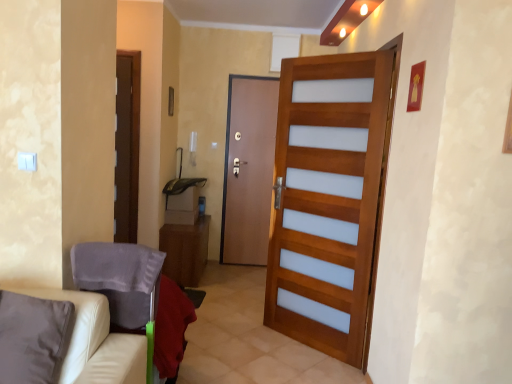
What do you see at coordinates (95, 342) in the screenshot? This screenshot has width=512, height=384. I see `beige leather couch at lower left` at bounding box center [95, 342].

This screenshot has width=512, height=384. What do you see at coordinates (248, 169) in the screenshot?
I see `brown wooden door at center, which is the second door in right-to-left order` at bounding box center [248, 169].

The height and width of the screenshot is (384, 512). What do you see at coordinates (328, 199) in the screenshot? I see `wooden door at center, the first door from the front` at bounding box center [328, 199].

What is the approximate width of wooden door at center, the second door from the back?

13.67 centimeters.

Describe the element at coordinates (122, 283) in the screenshot. I see `white leather armchair at lower left` at that location.

The height and width of the screenshot is (384, 512). I want to click on wooden cabinet at center, so click(x=185, y=250).

Locate an element on the screen. beige leather couch at lower left is located at coordinates (95, 342).

How distant is wooden cabinet at center from brown wooden door at center, the second door viewed from the front?

The distance of wooden cabinet at center from brown wooden door at center, the second door viewed from the front, is 29.19 inches.

Which is nearer, (x=202, y=248) or (x=241, y=190)?

Point (x=202, y=248) is positioned closer to the camera compared to point (x=241, y=190).

Can you confirm if wooden cabinet at center is thinner than brown wooden door at center, which is the second door in right-to-left order?

No, wooden cabinet at center is not thinner than brown wooden door at center, which is the second door in right-to-left order.

Are wooden cabinet at center and brown wooden door at center, positioned as the 1th door in left-to-right order, far apart?

No, wooden cabinet at center is not far from brown wooden door at center, positioned as the 1th door in left-to-right order.

From the image's perspective, which is above, wooden cabinet at center or wooden door at center, which appears as the 1th door when viewed from the right?

wooden door at center, which appears as the 1th door when viewed from the right, appears higher in the image.

Who is shorter, wooden cabinet at center or wooden door at center, the first door from the front?

wooden cabinet at center is shorter.

Image resolution: width=512 pixels, height=384 pixels. In order to click on the 2nd door positioned above the wooden cabinet at center (from a real-world perspective) in this screenshot , I will do `click(328, 199)`.

Considering the relative positions of wooden cabinet at center and wooden door at center, the first door from the front, in the image provided, is wooden cabinet at center to the left of wooden door at center, the first door from the front, from the viewer's perspective?

Correct, you'll find wooden cabinet at center to the left of wooden door at center, the first door from the front.

Considering the relative sizes of wooden door at center, the second door from the back, and brown wooden door at center, positioned as the 1th door in left-to-right order, in the image provided, is wooden door at center, the second door from the back, thinner than brown wooden door at center, positioned as the 1th door in left-to-right order,?

No.

Between wooden door at center, the second door in the left-to-right sequence, and brown wooden door at center, the second door viewed from the front, which one has more height?

wooden door at center, the second door in the left-to-right sequence.

The image size is (512, 384). I want to click on door above the brown wooden door at center, positioned as the 1th door in left-to-right order (from a real-world perspective), so click(x=328, y=199).

Considering the relative positions of wooden door at center, the first door from the front, and brown wooden door at center, the 1th door viewed from the back, in the image provided, is wooden door at center, the first door from the front, to the left of brown wooden door at center, the 1th door viewed from the back, from the viewer's perspective?

In fact, wooden door at center, the first door from the front, is to the right of brown wooden door at center, the 1th door viewed from the back.

Is the surface of beige leather couch at lower left in direct contact with wooden door at center, the second door in the left-to-right sequence?

There is a gap between beige leather couch at lower left and wooden door at center, the second door in the left-to-right sequence.

From the image's perspective, is beige leather couch at lower left positioned above or below wooden door at center, the second door in the left-to-right sequence?

Based on their image positions, beige leather couch at lower left is located beneath wooden door at center, the second door in the left-to-right sequence.

Could you tell me if beige leather couch at lower left is facing wooden door at center, the second door in the left-to-right sequence?

No.

Considering the sizes of objects beige leather couch at lower left and wooden door at center, the second door from the back, in the image provided, who is wider, beige leather couch at lower left or wooden door at center, the second door from the back,?

beige leather couch at lower left is wider.

Is point (122, 300) more distant than point (100, 363)?

Yes, it is behind point (100, 363).

From a real-world perspective, is white leather armchair at lower left beneath beige leather couch at lower left?

Indeed, from a real-world perspective, white leather armchair at lower left is positioned beneath beige leather couch at lower left.

Is white leather armchair at lower left in front of or behind beige leather couch at lower left in the image?

Visually, white leather armchair at lower left is located behind beige leather couch at lower left.

Considering the relative positions of white leather armchair at lower left and beige leather couch at lower left in the image provided, is white leather armchair at lower left to the left of beige leather couch at lower left from the viewer's perspective?

No, white leather armchair at lower left is not to the left of beige leather couch at lower left.

Between brown wooden door at center, the 1th door viewed from the back, and wooden cabinet at center, which one has smaller width?

With smaller width is brown wooden door at center, the 1th door viewed from the back.

Would you consider brown wooden door at center, which is the second door in right-to-left order, to be distant from wooden cabinet at center?

brown wooden door at center, which is the second door in right-to-left order, is near wooden cabinet at center, not far away.

Based on their positions, is brown wooden door at center, the 1th door viewed from the back, located to the left or right of wooden cabinet at center?

brown wooden door at center, the 1th door viewed from the back, is positioned on wooden cabinet at center's right side.

I want to click on table below the brown wooden door at center, the 1th door viewed from the back (from the image's perspective), so click(185, 250).

Locate an element on the screen. The width and height of the screenshot is (512, 384). table above the beige leather couch at lower left (from the image's perspective) is located at coordinates (185, 250).

Is beige leather couch at lower left inside the boundaries of wooden cabinet at center, or outside?

beige leather couch at lower left is located beyond the bounds of wooden cabinet at center.

Is beige leather couch at lower left bigger or smaller than wooden cabinet at center?

Considering their sizes, beige leather couch at lower left takes up less space than wooden cabinet at center.

The height and width of the screenshot is (384, 512). Identify the location of door that appears behind the wooden cabinet at center. (248, 169).

At what (x,y) coordinates should I click in order to perform the action: click on the 2nd door directly above the wooden cabinet at center (from a real-world perspective). Please return your answer as a coordinate pair (x, y). This screenshot has height=384, width=512. Looking at the image, I should click on (328, 199).

Considering their positions, is brown wooden door at center, positioned as the 1th door in left-to-right order, positioned closer to white leather armchair at lower left than wooden door at center, the second door in the left-to-right sequence?

wooden door at center, the second door in the left-to-right sequence, is closer to white leather armchair at lower left.

From the image, which object appears to be nearer to brown wooden door at center, which is the second door in right-to-left order, wooden cabinet at center or white leather armchair at lower left?

wooden cabinet at center.

From the picture: Based on their spatial positions, is beige leather couch at lower left or wooden cabinet at center further from wooden door at center, which appears as the 1th door when viewed from the right?

Based on the image, beige leather couch at lower left appears to be further to wooden door at center, which appears as the 1th door when viewed from the right.

Based on their spatial positions, is beige leather couch at lower left or brown wooden door at center, which is the second door in right-to-left order, closer to wooden cabinet at center?

brown wooden door at center, which is the second door in right-to-left order, is positioned closer to the anchor wooden cabinet at center.

Considering their positions, is brown wooden door at center, positioned as the 1th door in left-to-right order, positioned further to wooden cabinet at center than white leather armchair at lower left?

white leather armchair at lower left.

When comparing their distances from beige leather couch at lower left, does white leather armchair at lower left or wooden cabinet at center seem further?

wooden cabinet at center is positioned further to the anchor beige leather couch at lower left.

Looking at the image, which one is located further to beige leather couch at lower left, wooden cabinet at center or white leather armchair at lower left?

wooden cabinet at center is positioned further to the anchor beige leather couch at lower left.

In the scene shown: Considering their positions, is wooden cabinet at center positioned further to white leather armchair at lower left than beige leather couch at lower left?

wooden cabinet at center is further to white leather armchair at lower left.

This screenshot has height=384, width=512. I want to click on door between white leather armchair at lower left and brown wooden door at center, the 1th door viewed from the back, in the front-back direction, so click(x=328, y=199).

Identify the location of armchair between beige leather couch at lower left and wooden cabinet at center from front to back. (122, 283).

At what (x,y) coordinates should I click in order to perform the action: click on door positioned between white leather armchair at lower left and wooden cabinet at center from near to far. Please return your answer as a coordinate pair (x, y). The width and height of the screenshot is (512, 384). Looking at the image, I should click on (328, 199).

Locate an element on the screen. door between beige leather couch at lower left and wooden cabinet at center in the front-back direction is located at coordinates (328, 199).